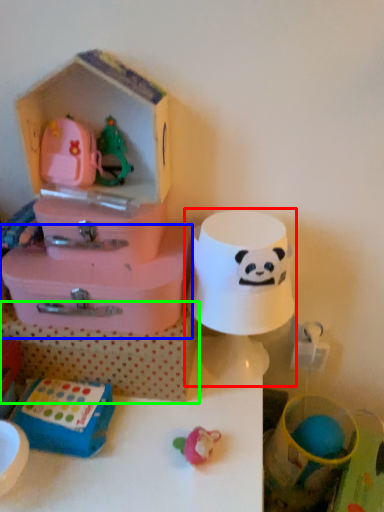
Question: Estimate the real-world distances between objects in this image. Which object is farther from toy (highlighted by a red box), storage box (highlighted by a blue box) or storage box (highlighted by a green box)?

Choices:
 (A) storage box
 (B) storage box

Answer: (B)